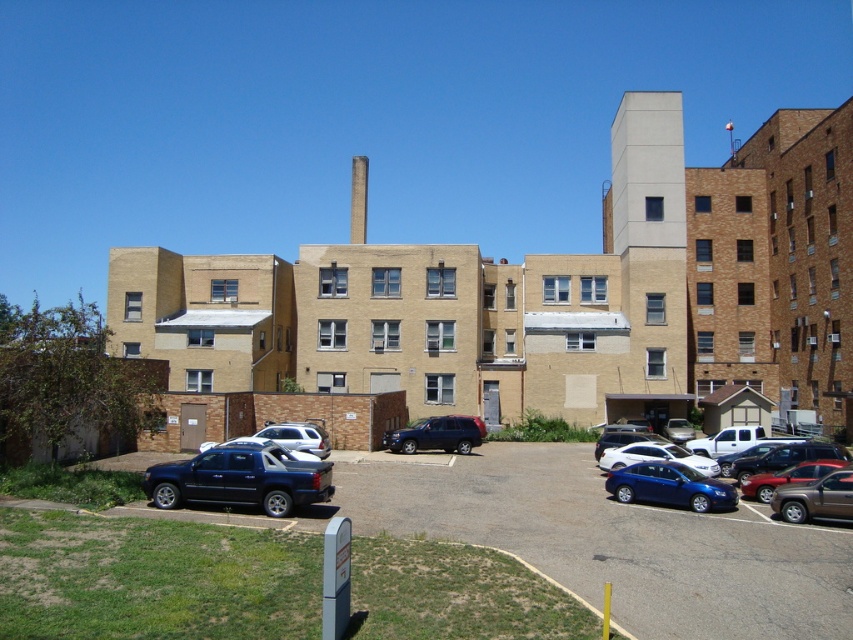
Who is shorter, matte black truck at lower left or matte blue sedan at center?

With less height is matte black truck at lower left.

Between matte black truck at lower left and matte blue sedan at center, which one is positioned higher?

Positioned higher is matte black truck at lower left.

Is point (242, 452) positioned behind point (706, 492)?

That is False.

This screenshot has height=640, width=853. What are the coordinates of `matte black truck at lower left` in the screenshot? It's located at (241, 477).

Is point (537, 531) in front of point (676, 483)?

Yes, point (537, 531) is closer to viewer.

Who is more forward, (498, 477) or (683, 476)?

Positioned in front is point (683, 476).

Where is `metallic blue truck at lower left`? Image resolution: width=853 pixels, height=640 pixels. metallic blue truck at lower left is located at coordinates (610, 540).

Which is above, matte black truck at lower left or shiny blue sedan at lower right?

Positioned higher is matte black truck at lower left.

Is matte black truck at lower left behind shiny blue sedan at lower right?

No, matte black truck at lower left is in front of shiny blue sedan at lower right.

From the picture: Who is more distant from viewer, (173, 470) or (613, 461)?

The point (613, 461) is behind.

This screenshot has width=853, height=640. In order to click on matte black truck at lower left in this screenshot , I will do `click(241, 477)`.